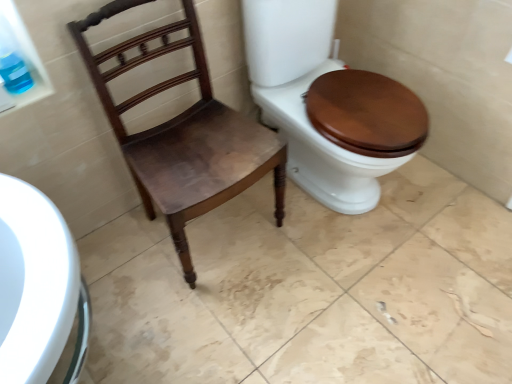
Question: Is wooden toilet seat at right facing away from matte brown wood chair at center?

Choices:
 (A) yes
 (B) no

Answer: (B)

Question: Is wooden toilet seat at right bigger than matte brown wood chair at center?

Choices:
 (A) no
 (B) yes

Answer: (B)

Question: Would you say matte brown wood chair at center is part of wooden toilet seat at right's contents?

Choices:
 (A) yes
 (B) no

Answer: (B)

Question: Is wooden toilet seat at right thinner than matte brown wood chair at center?

Choices:
 (A) yes
 (B) no

Answer: (B)

Question: Is wooden toilet seat at right in front of matte brown wood chair at center?

Choices:
 (A) yes
 (B) no

Answer: (B)

Question: Can you confirm if wooden toilet seat at right is smaller than matte brown wood chair at center?

Choices:
 (A) no
 (B) yes

Answer: (A)

Question: Does matte brown wood chair at center have a lesser height compared to wooden toilet seat at right?

Choices:
 (A) no
 (B) yes

Answer: (B)

Question: Is matte brown wood chair at center outside wooden toilet seat at right?

Choices:
 (A) no
 (B) yes

Answer: (B)

Question: Considering the relative sizes of matte brown wood chair at center and wooden toilet seat at right in the image provided, is matte brown wood chair at center wider than wooden toilet seat at right?

Choices:
 (A) no
 (B) yes

Answer: (A)

Question: From a real-world perspective, is matte brown wood chair at center over wooden toilet seat at right?

Choices:
 (A) no
 (B) yes

Answer: (A)

Question: Does matte brown wood chair at center have a lesser width compared to wooden toilet seat at right?

Choices:
 (A) yes
 (B) no

Answer: (A)

Question: Considering the relative positions of matte brown wood chair at center and wooden toilet seat at right in the image provided, is matte brown wood chair at center to the left of wooden toilet seat at right from the viewer's perspective?

Choices:
 (A) yes
 (B) no

Answer: (A)

Question: Do you think wooden toilet seat at right is within matte brown wood chair at center, or outside of it?

Choices:
 (A) outside
 (B) inside

Answer: (A)